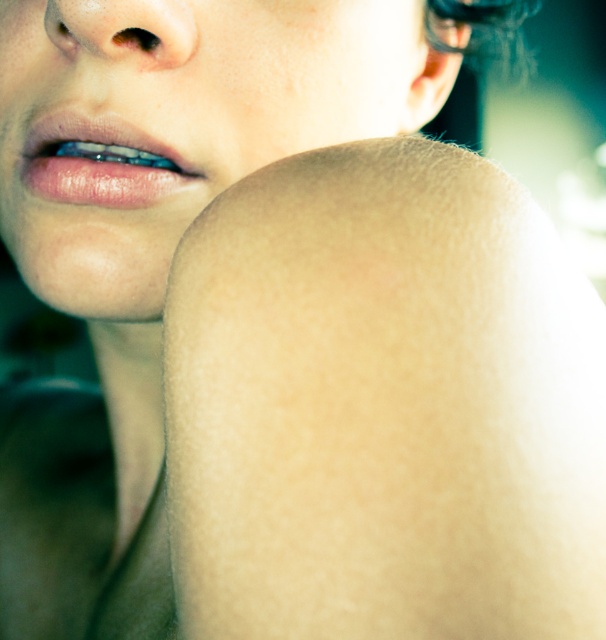
You are a photographer adjusting the focus of your camera. You want to ensure that both the smooth skin at lower left and the dark brown hair at upper center are in sharp focus. Based on the scene description, which object should you focus on to achieve this?

You should focus on the dark brown hair at upper center because the smooth skin at lower left is in front of it, meaning the distance between them is minimal. By focusing on the farther object, you can ensure both are within the depth of field.

You are a photographer adjusting lighting for a portrait. You notice the smooth skin at lower left and dark brown hair at upper center in your frame. Which object is located to the left of the other?

The smooth skin at lower left is positioned on the left side of dark brown hair at upper center.